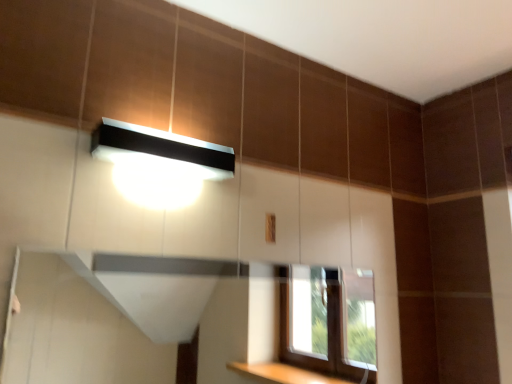
You are a GUI agent. You are given a task and a screenshot of the screen. Output one action in this format:
    pyautogui.click(x=<x>, y=<y>)
    Task: Click on the matte black rectangular light fixture at upper center
    The image size is (512, 384).
    Given the screenshot: What is the action you would take?
    pyautogui.click(x=159, y=163)

Image resolution: width=512 pixels, height=384 pixels. What do you see at coordinates (159, 163) in the screenshot? I see `matte black rectangular light fixture at upper center` at bounding box center [159, 163].

Where is `matte black rectangular light fixture at upper center`? The image size is (512, 384). matte black rectangular light fixture at upper center is located at coordinates (159, 163).